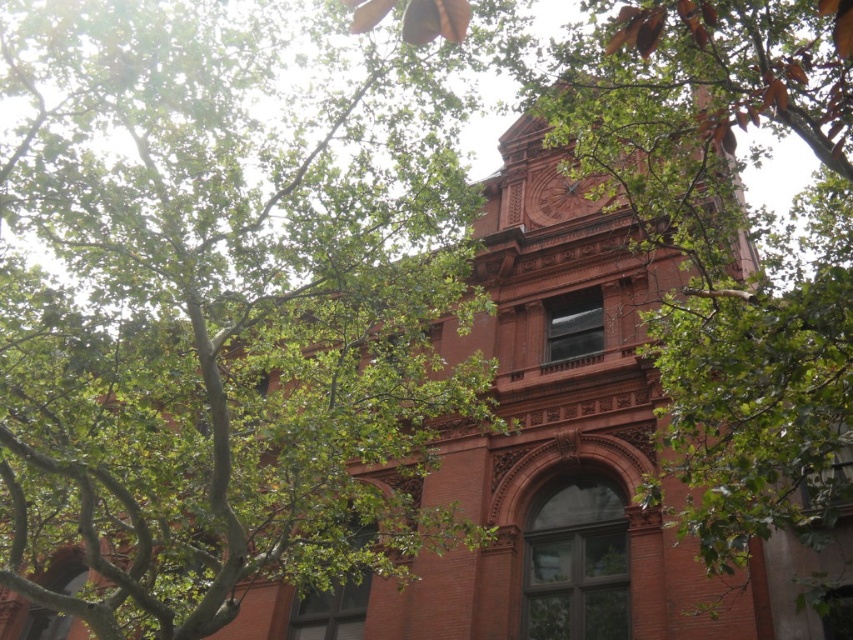
Looking at this image, you are an architect inspecting the building facade. You notice the green leafy tree at upper center and the matte brown clock at upper center. Which object is closer to the top of the image?

The matte brown clock at upper center is closer to the top of the image because the green leafy tree at upper center is positioned under it.

You are standing in front of a red brick building with ornate details. You notice a point marked at coordinates (222, 304). What object does this coordinate point to?

The point at coordinates (222, 304) corresponds to the green leafy tree at upper center.

Consider the image. You are an architect designing a new garden layout near the red brick building. You need to place a statue exactly at the center of the building facade. Given the green leafy tree at upper center is at point 0.475, 0.261, can you determine if the statue placement will be obstructed by the tree?

The green leafy tree at upper center is located at coordinates [222,304]. Since the statue is to be placed at the center of the building facade, which is likely at the center point of the building image, the tree might obstruct the view depending on the exact placement. However, without knowing the exact center coordinates of the building, it is impossible to determine obstruction precisely. The question lacks sufficient data for a definitive answer.